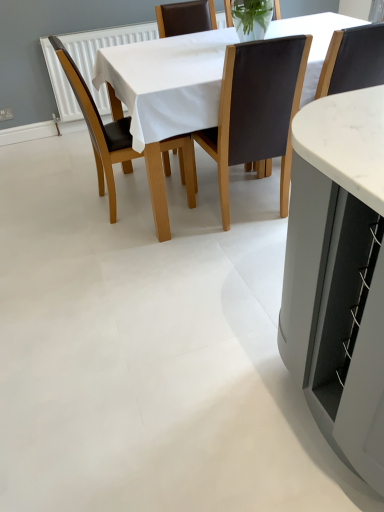
Where is `vacant space positioned to the left of brown leather chair at center, arranged as the 1th chair when viewed from the left`? vacant space positioned to the left of brown leather chair at center, arranged as the 1th chair when viewed from the left is located at coordinates (66, 207).